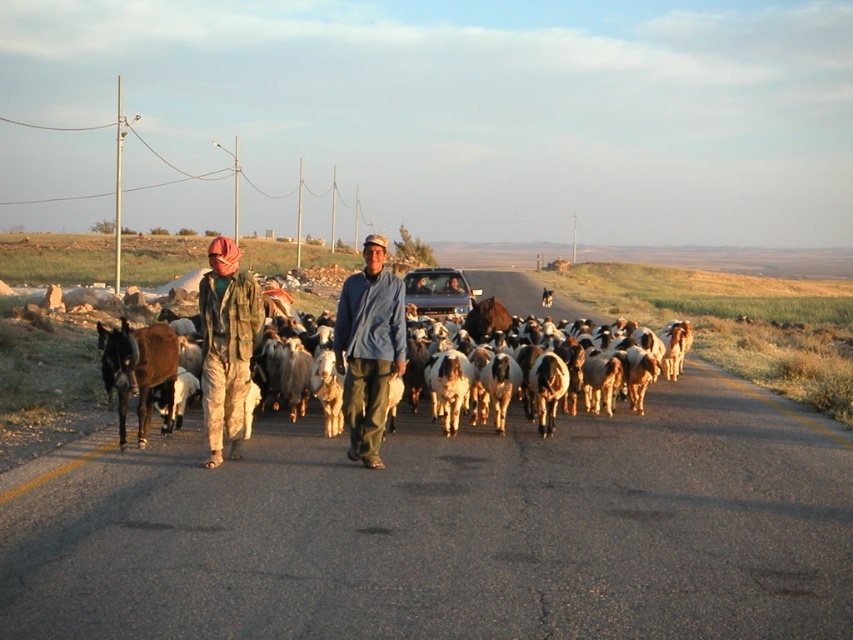
Looking at this image, who is more distant from viewer, (373,356) or (428,284)?

The point (428,284) is behind.

Does white woolen goats at center have a smaller size compared to metallic silver truck at center?

No.

You are a GUI agent. You are given a task and a screenshot of the screen. Output one action in this format:
    pyautogui.click(x=<x>, y=<y>)
    Task: Click on the white woolen goats at center
    The width and height of the screenshot is (853, 640).
    Given the screenshot: What is the action you would take?
    pyautogui.click(x=486, y=316)

The image size is (853, 640). Find the location of `white woolen goats at center`. white woolen goats at center is located at coordinates (486, 316).

Does camouflage fabric at left appear on the right side of white woolen goats at center?

Result: Incorrect, camouflage fabric at left is not on the right side of white woolen goats at center.

Identify the location of camouflage fabric at left. This screenshot has width=853, height=640. tap(225, 346).

Does camouflage fabric at left have a greater height compared to metallic silver truck at center?

Indeed, camouflage fabric at left has a greater height compared to metallic silver truck at center.

Does camouflage fabric at left come in front of metallic silver truck at center?

Yes, camouflage fabric at left is in front of metallic silver truck at center.

Image resolution: width=853 pixels, height=640 pixels. What do you see at coordinates (225, 346) in the screenshot? I see `camouflage fabric at left` at bounding box center [225, 346].

Locate an element on the screen. The image size is (853, 640). camouflage fabric at left is located at coordinates (225, 346).